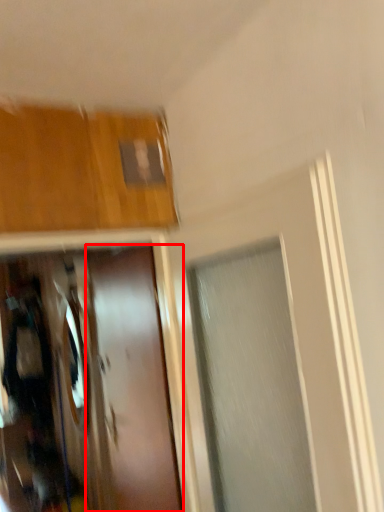
Question: From the image's perspective, what is the correct spatial relationship of door (annotated by the red box) in relation to mirror?

Choices:
 (A) below
 (B) above

Answer: (B)